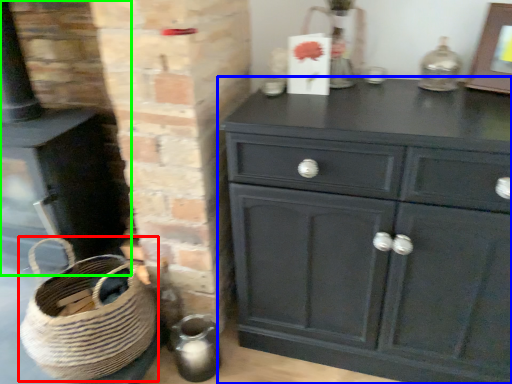
Question: Considering the real-world distances, which object is closest to basket (highlighted by a red box)? chest of drawers (highlighted by a blue box) or fireplace (highlighted by a green box).

Choices:
 (A) chest of drawers
 (B) fireplace

Answer: (B)